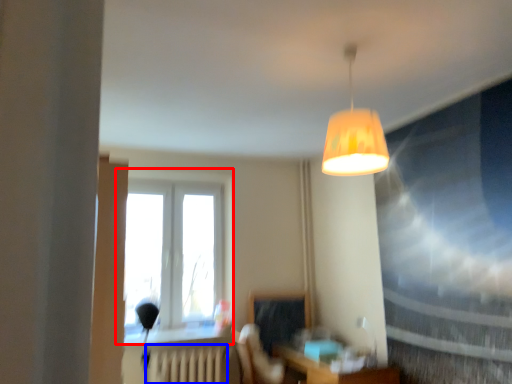
Question: Which point is further to the camera, window (highlighted by a red box) or radiator (highlighted by a blue box)?

Choices:
 (A) window
 (B) radiator

Answer: (A)